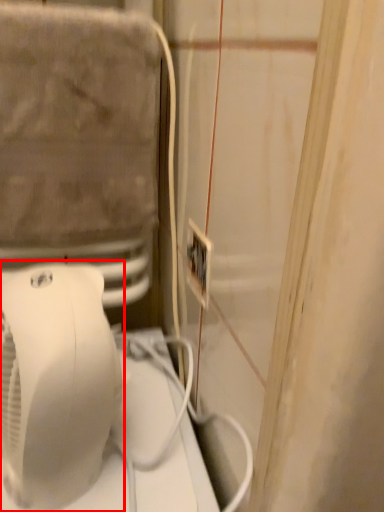
Question: From the image's perspective, where is home appliance (annotated by the red box) located in relation to electric outlet in the image?

Choices:
 (A) above
 (B) below

Answer: (B)